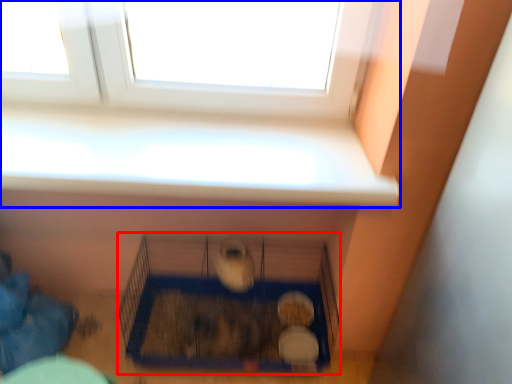
Question: Which object is closer to the camera taking this photo, bird cage (highlighted by a red box) or window (highlighted by a blue box)?

Choices:
 (A) bird cage
 (B) window

Answer: (B)